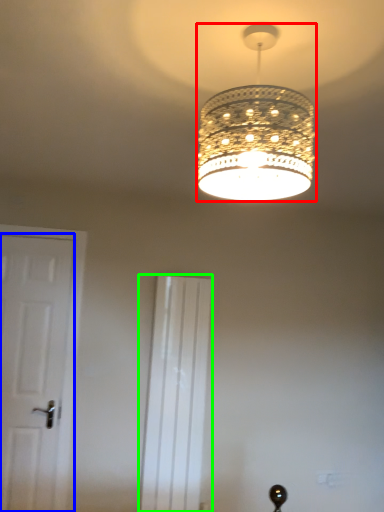
Question: Which object is the closest to the lamp (highlighted by a red box)? Choose among these: door (highlighted by a blue box) or screen door (highlighted by a green box).

Choices:
 (A) door
 (B) screen door

Answer: (B)